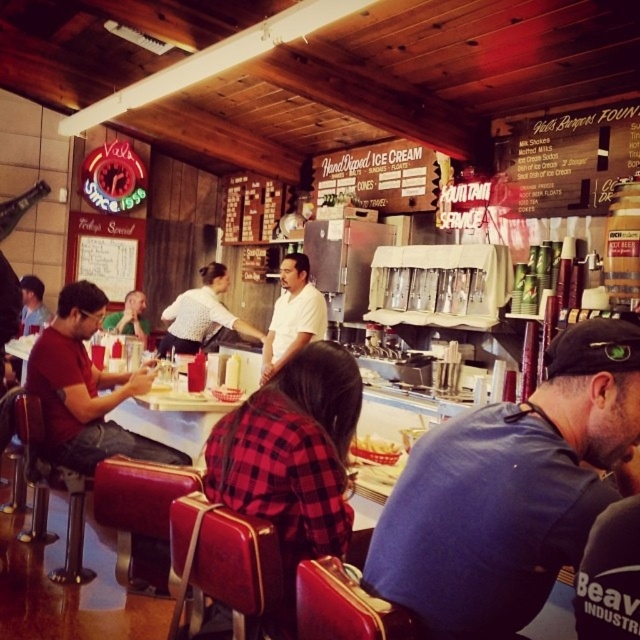
Question: Which point appears closest to the camera in this image?

Choices:
 (A) (576, 163)
 (B) (360, 445)

Answer: (B)

Question: Which point appears farthest from the camera in this image?

Choices:
 (A) (292, 264)
 (B) (545, 145)

Answer: (A)

Question: Among these objects, which one is nearest to the camera?

Choices:
 (A) white matte shirt at center
 (B) matte black shirt at left
 (C) white paperboard menu at upper right
 (D) white shirt at center

Answer: (C)

Question: Is blue cotton shirt at center above matte red shirt at left?

Choices:
 (A) no
 (B) yes

Answer: (B)

Question: Can you confirm if white paperboard menu at upper right is positioned to the left of white shirt at center?

Choices:
 (A) no
 (B) yes

Answer: (A)

Question: Does white shirt at center come in front of golden crispy french fries at center?

Choices:
 (A) no
 (B) yes

Answer: (A)